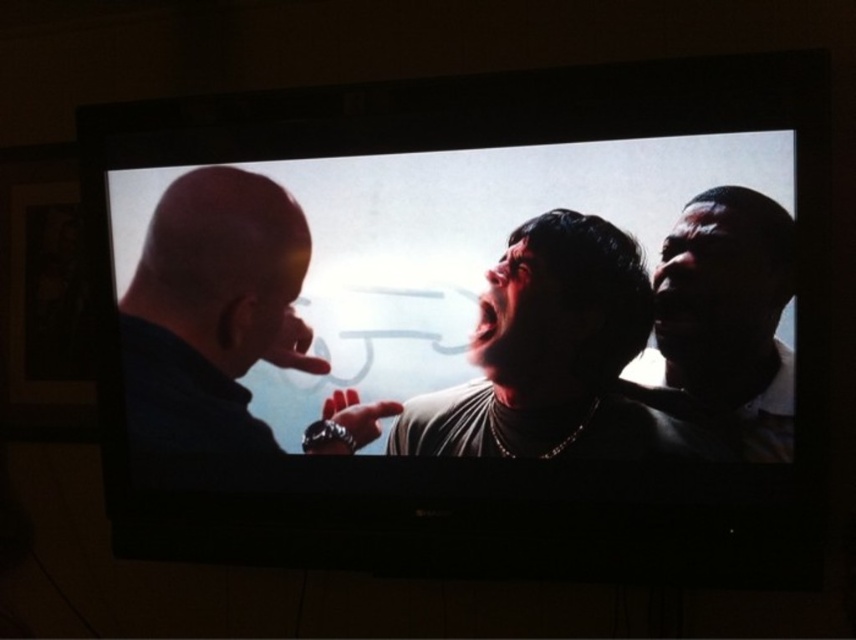
Question: Is bald head at left positioned before dark gray shirt at center?

Choices:
 (A) no
 (B) yes

Answer: (A)

Question: Is bald head at left below dark skin textured face at right?

Choices:
 (A) no
 (B) yes

Answer: (A)

Question: Based on their relative distances, which object is farther from the bald head at left?

Choices:
 (A) dark gray shirt at center
 (B) dark skin textured face at right

Answer: (B)

Question: Which object is positioned closest to the bald head at left?

Choices:
 (A) dark gray shirt at center
 (B) dark skin textured face at right

Answer: (A)

Question: Which of the following is the farthest from the observer?

Choices:
 (A) (141, 324)
 (B) (700, 202)

Answer: (A)

Question: Observing the image, what is the correct spatial positioning of bald head at left in reference to dark gray shirt at center?

Choices:
 (A) above
 (B) below

Answer: (A)